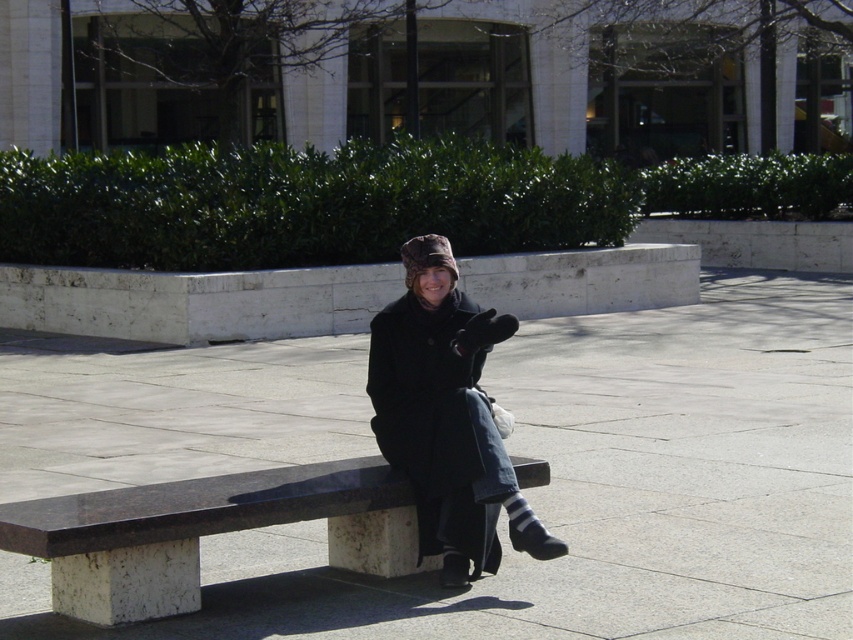
Question: Is dark brown polished wood bench at center smaller than black woolen coat at center?

Choices:
 (A) no
 (B) yes

Answer: (A)

Question: In this image, where is dark brown polished wood bench at center located relative to black woolen coat at center?

Choices:
 (A) above
 (B) below

Answer: (B)

Question: Which of the following is the closest to the observer?

Choices:
 (A) black woolen coat at center
 (B) dark brown polished wood bench at center

Answer: (B)

Question: Is dark brown polished wood bench at center positioned in front of black woolen coat at center?

Choices:
 (A) yes
 (B) no

Answer: (A)

Question: Among these objects, which one is nearest to the camera?

Choices:
 (A) black woolen coat at center
 (B) dark brown polished wood bench at center

Answer: (B)

Question: Which object is closer to the camera taking this photo?

Choices:
 (A) black woolen coat at center
 (B) dark brown polished wood bench at center

Answer: (B)